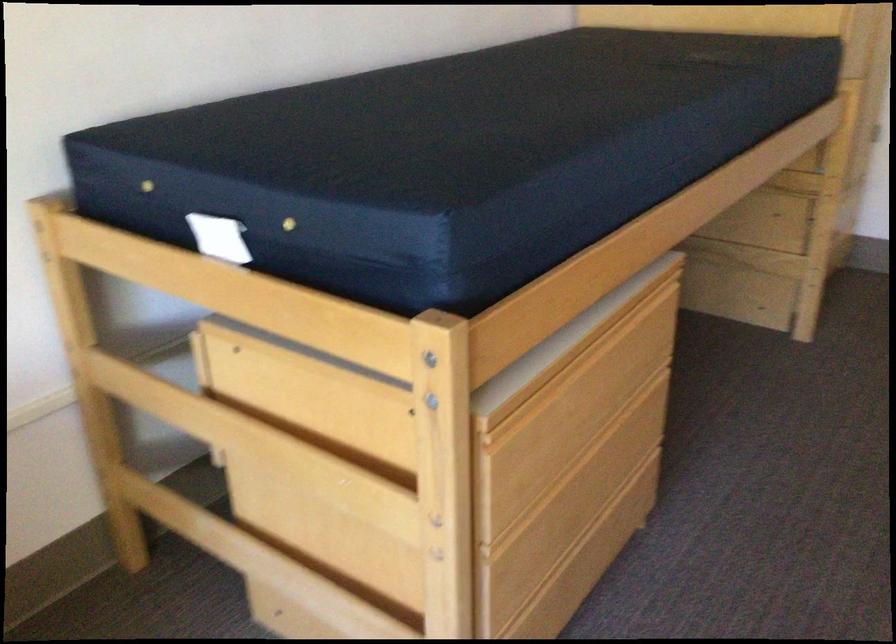
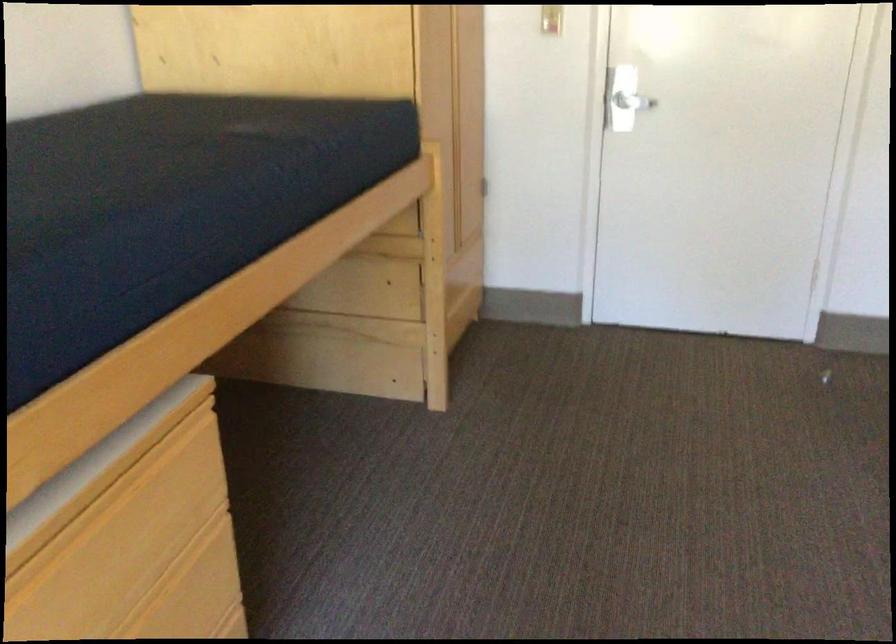
Which direction would the cameraman need to move to produce the second image?

The movement direction of the cameraman is right, forward.